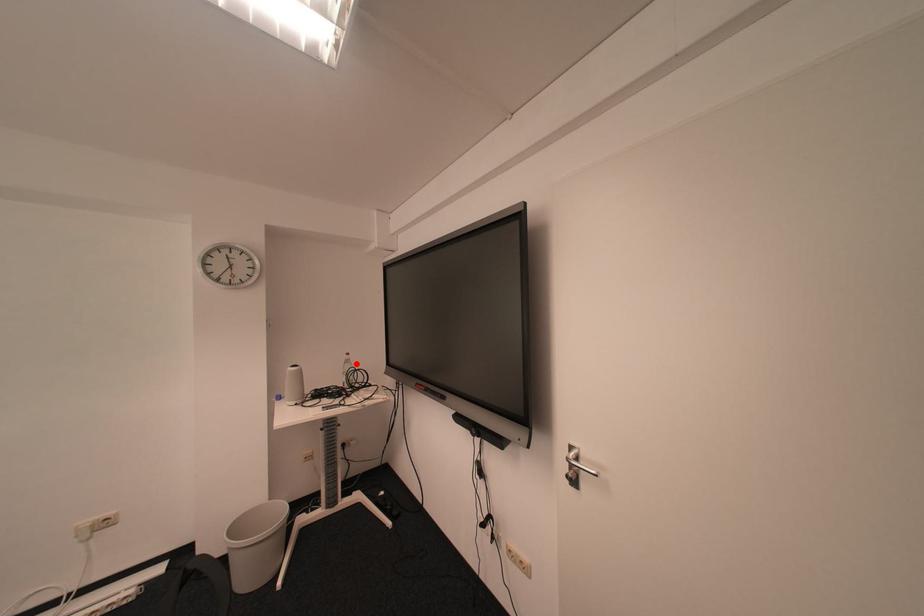
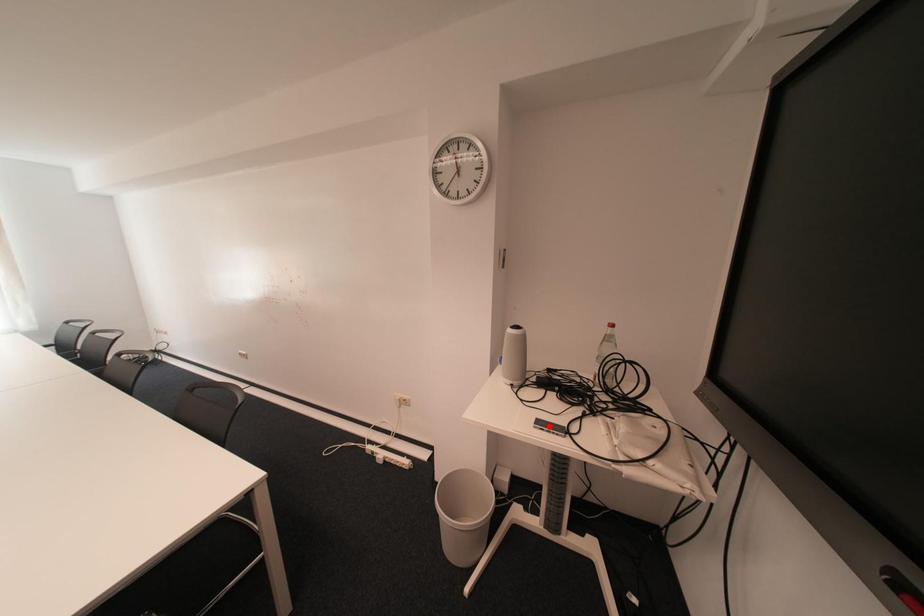
I am providing you with two images of the same scene from different viewpoints. A red point is marked on the first image and another point is marked on the second image. Is the marked point in image1 the same physical position as the marked point in image2?

No